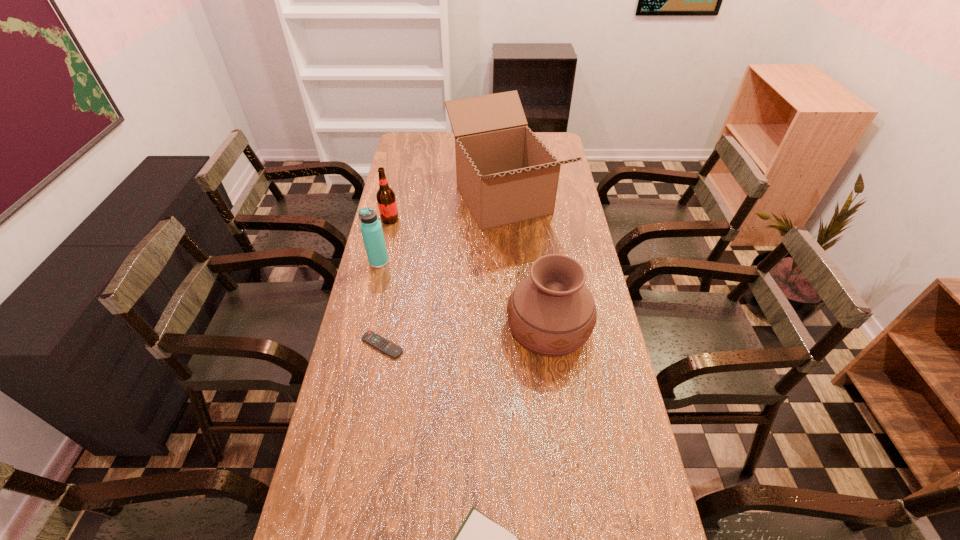
Identify the location of the tallest object. (505, 174).

Image resolution: width=960 pixels, height=540 pixels. I want to click on urn, so click(551, 312).

This screenshot has height=540, width=960. I want to click on thermos bottle, so click(371, 228).

The image size is (960, 540). I want to click on root beer, so click(386, 200).

The width and height of the screenshot is (960, 540). I want to click on the shortest object, so click(x=387, y=347).

You are a GUI agent. You are given a task and a screenshot of the screen. Output one action in this format:
    pyautogui.click(x=<x>, y=<y>)
    Task: Click on the vacant point located 0.150m on the left of the tallest object
    This screenshot has height=540, width=960.
    Given the screenshot: What is the action you would take?
    pyautogui.click(x=408, y=200)

Where is `blank space located 0.260m on the front of the urn`? This screenshot has height=540, width=960. blank space located 0.260m on the front of the urn is located at coordinates (566, 460).

The height and width of the screenshot is (540, 960). I want to click on vacant region located 0.330m on the back of the third farthest object, so click(394, 198).

Locate an element on the screen. The width and height of the screenshot is (960, 540). vacant space positioned 0.090m on the front of the root beer is located at coordinates (385, 241).

Where is `free location located on the right of the remote control`? free location located on the right of the remote control is located at coordinates (445, 346).